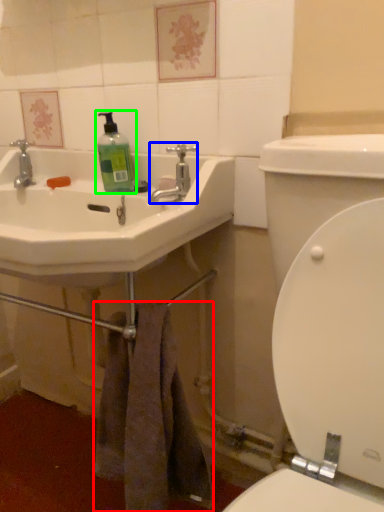
Question: Considering the real-world distances, which object is closest to towel/napkin (highlighted by a red box)? tap (highlighted by a blue box) or cleaning product (highlighted by a green box).

Choices:
 (A) tap
 (B) cleaning product

Answer: (A)